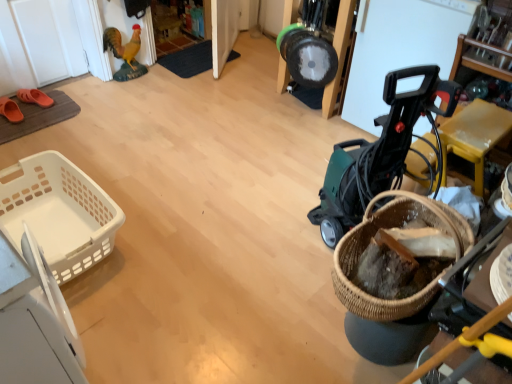
Question: In the image, is black plastic bucket at upper center on the left side or the right side of orange rubber sandals at left, which appears as the 1th footwear when viewed from the front?

Choices:
 (A) left
 (B) right

Answer: (B)

Question: From their relative heights in the image, would you say black plastic bucket at upper center is taller or shorter than orange rubber sandals at left, the second footwear in the back-to-front sequence?

Choices:
 (A) short
 (B) tall

Answer: (B)

Question: Estimate the real-world distances between objects in this image. Which object is closer to the orange rubber clog at left, marked as the 2th footwear in a front-to-back arrangement?

Choices:
 (A) black plastic bucket at upper center
 (B) white plastic basket at left, the 1th basket when ordered from back to front
 (C) orange rubber sandals at left, which appears as the 1th footwear when viewed from the front
 (D) green plastic baby carriage at right
 (E) woven brown basket at lower right, arranged as the 1th basket when viewed from the front

Answer: (C)

Question: Considering the real-world distances, which object is closest to the white plastic basket at left, placed as the 1th basket when sorted from left to right?

Choices:
 (A) woven brown basket at lower right, the first basket viewed from the right
 (B) orange rubber sandals at left, which appears as the 1th footwear when viewed from the front
 (C) black plastic bucket at upper center
 (D) orange rubber clog at left, marked as the 2th footwear in a front-to-back arrangement
 (E) green plastic baby carriage at right

Answer: (B)